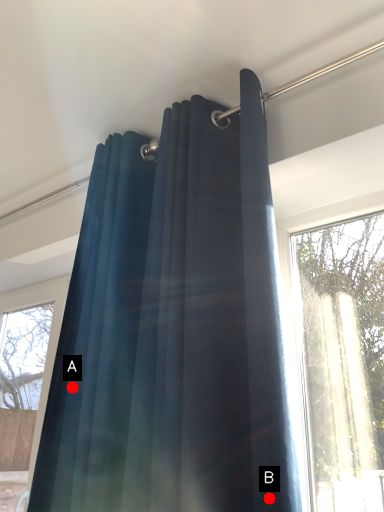
Question: Two points are circled on the image, labeled by A and B beside each circle. Which point is closer to the camera?

Choices:
 (A) A is closer
 (B) B is closer

Answer: (B)